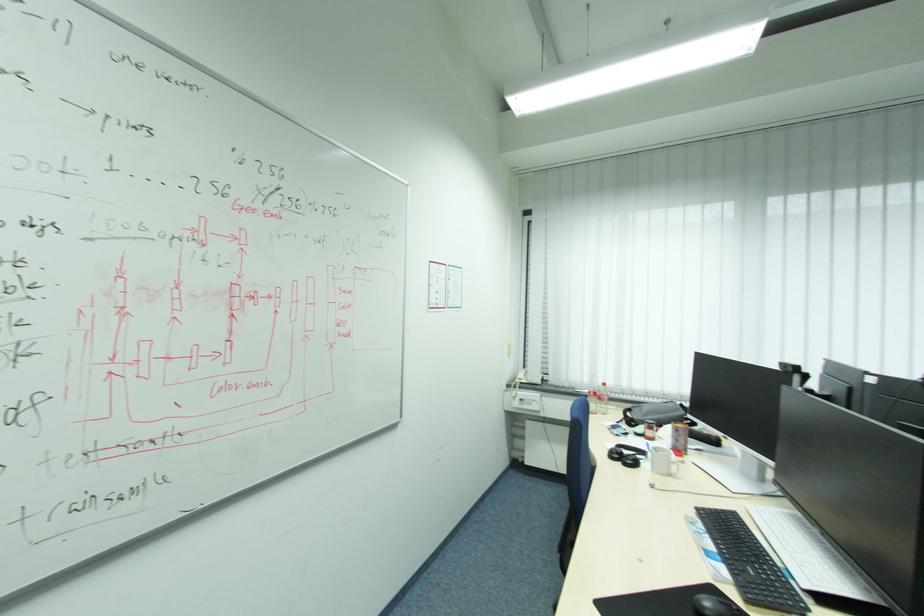
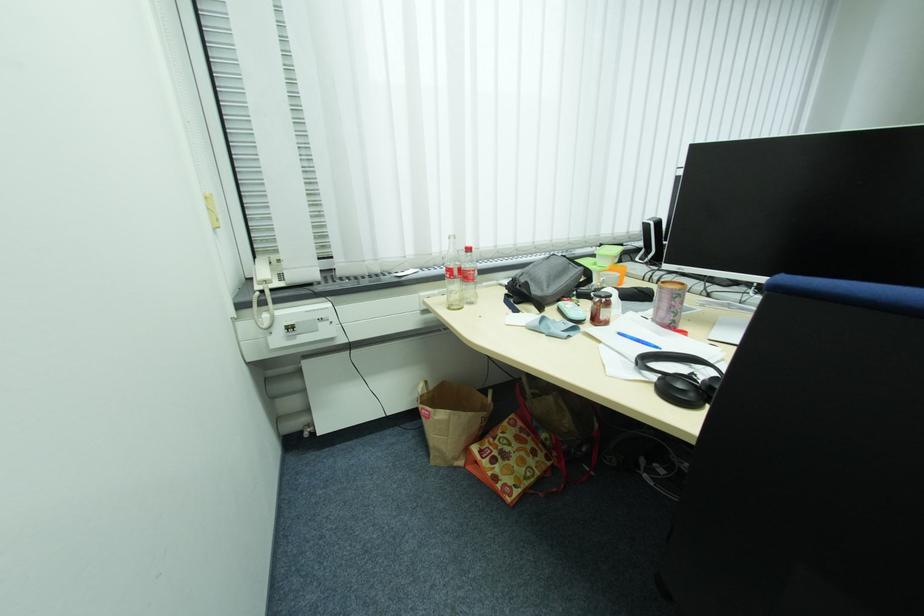
Find the pixel in the second image that matches (x=530, y=368) in the first image.

(261, 256)